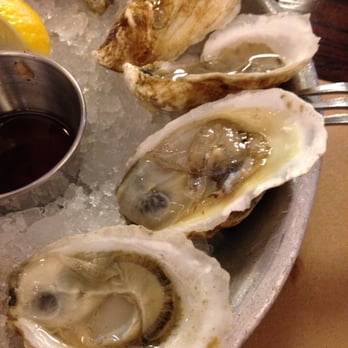
Identify the location of table. The image size is (348, 348). (334, 16).